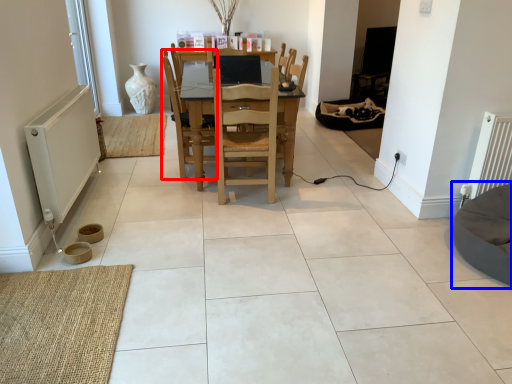
Question: Which of the following is the farthest to the observer, chair (highlighted by a red box) or bean bag chair (highlighted by a blue box)?

Choices:
 (A) chair
 (B) bean bag chair

Answer: (A)